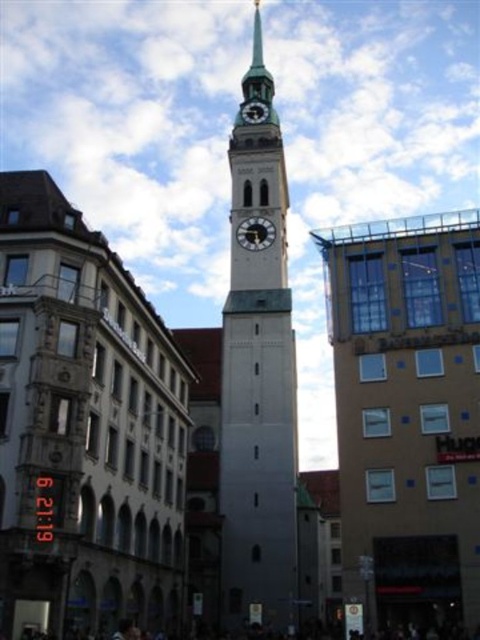
Question: Can you confirm if white stone clock tower at center is positioned to the left of metallic clock face at center?

Choices:
 (A) no
 (B) yes

Answer: (A)

Question: Can you confirm if white stone clock tower at center is smaller than metallic clock face at center?

Choices:
 (A) yes
 (B) no

Answer: (B)

Question: Considering the real-world distances, which object is closest to the metallic clock tower at center?

Choices:
 (A) metallic clock face at center
 (B) white stone clock tower at center

Answer: (B)

Question: Does metallic clock face at center come in front of metallic clock tower at center?

Choices:
 (A) no
 (B) yes

Answer: (B)

Question: Which object is closer to the camera taking this photo?

Choices:
 (A) white stone clock tower at center
 (B) metallic clock face at center

Answer: (A)

Question: Which of the following is the closest to the observer?

Choices:
 (A) metallic clock tower at center
 (B) white stone clock tower at center

Answer: (B)